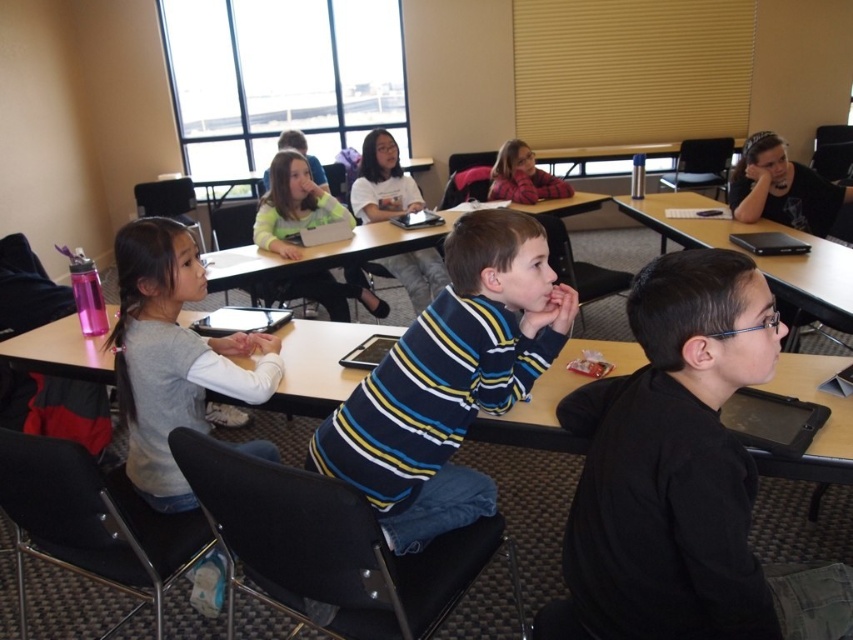
You are a student in the classroom. You want to borrow a black plastic tablet at right from the desk located at point (x=756, y=256). Can you reach it from your current position?

The black plastic tablet at right is located at point (x=756, y=256), so yes, you can reach it from your current position if you are at that point.

What is the object located at the coordinates point (450,380) in the classroom scene?

The object at point (450,380) is the striped cotton shirt at center.